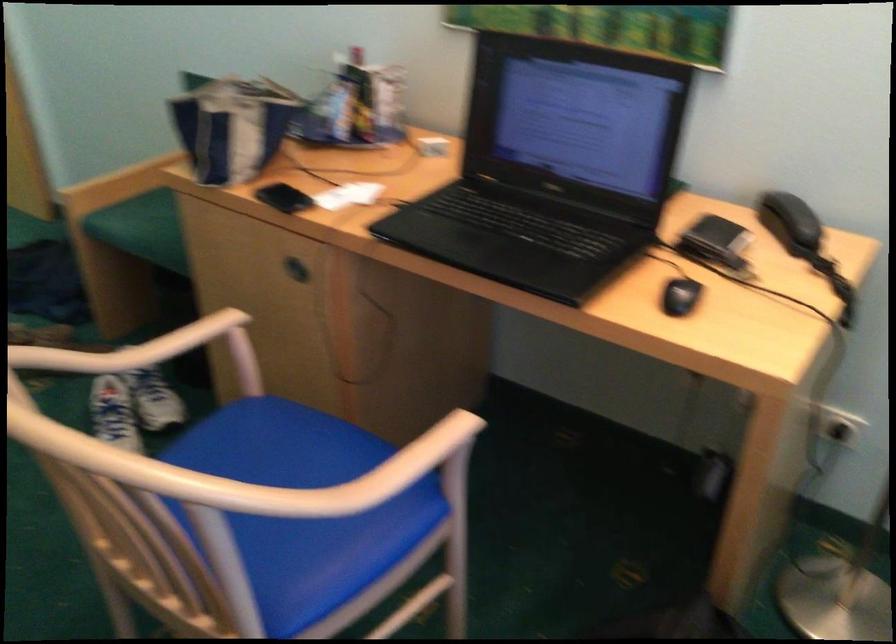
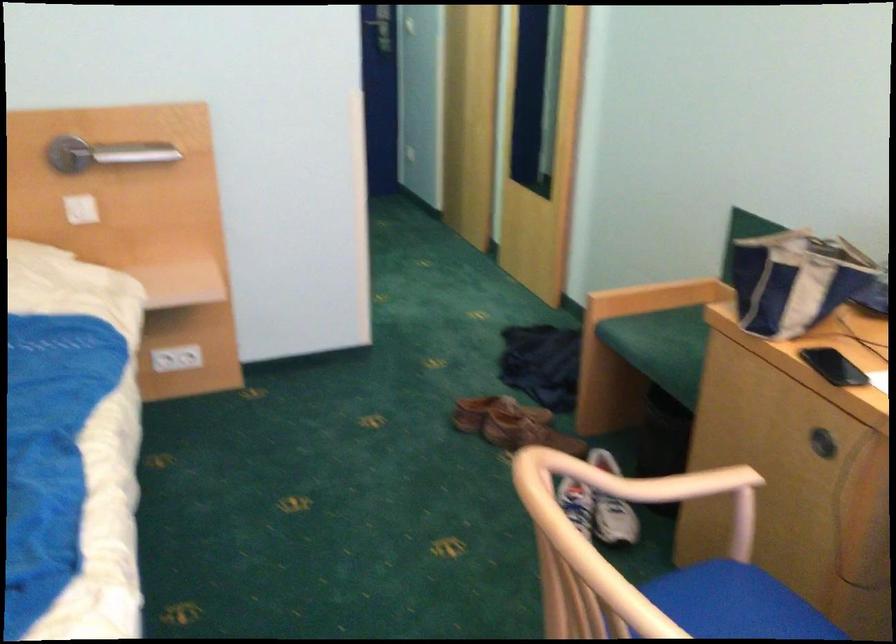
Question: The first image is from the beginning of the video and the second image is from the end. How did the camera likely rotate when shooting the video?

Choices:
 (A) Left
 (B) Right
 (C) Up
 (D) Down

Answer: (A)